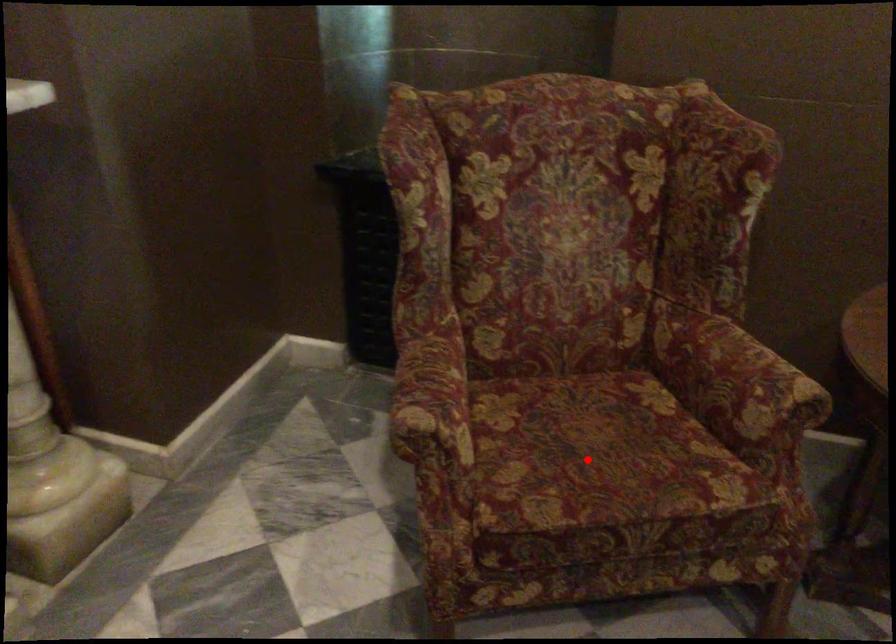
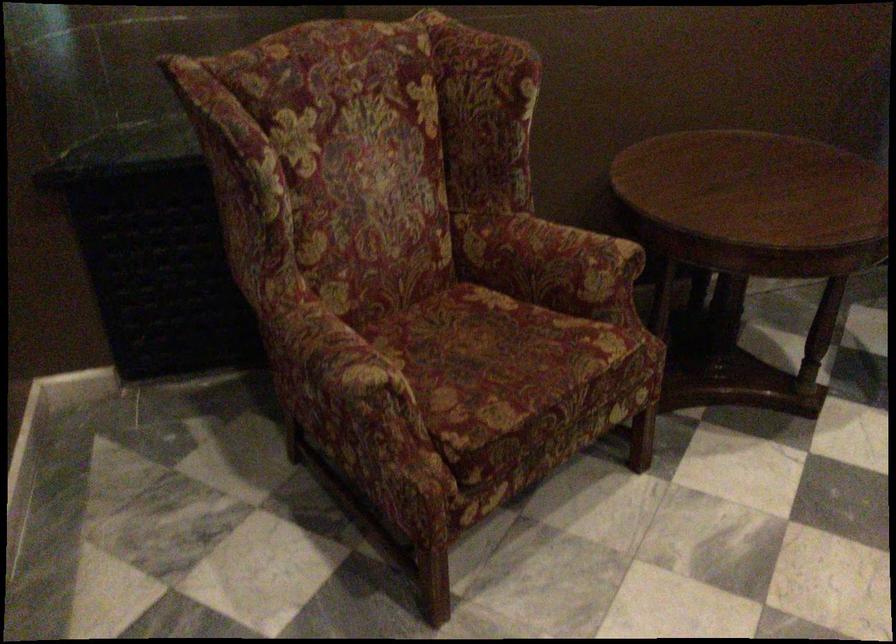
Locate, in the second image, the point that corresponds to the highlighted location in the first image.

(495, 363)